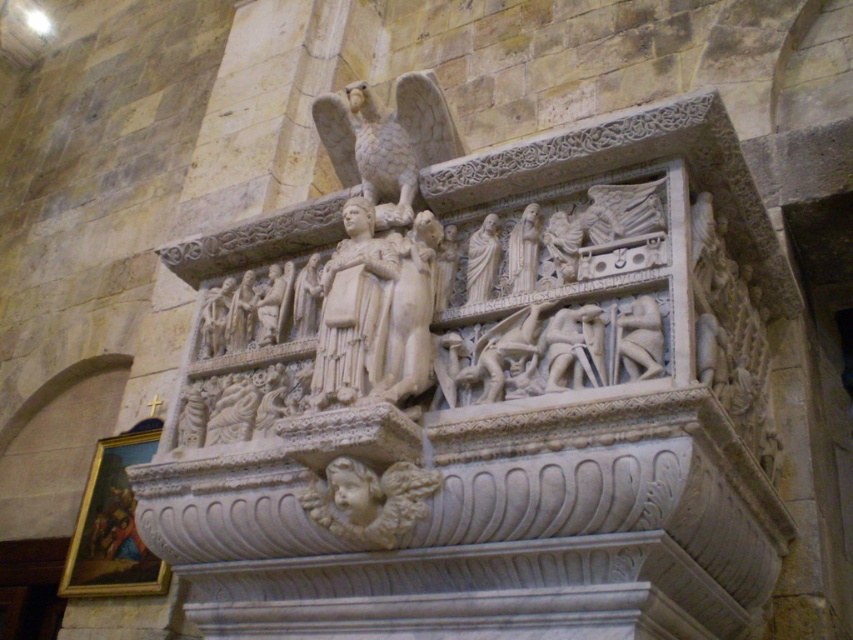
Is white marble eagle at upper center above white marble statue at center?

Indeed, white marble eagle at upper center is positioned over white marble statue at center.

Identify the location of white marble eagle at upper center. (387, 140).